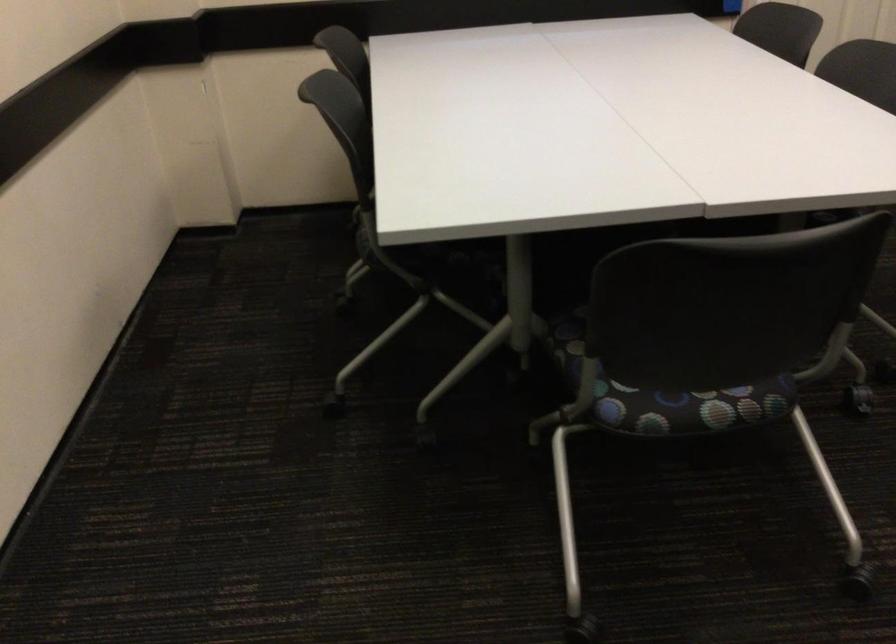
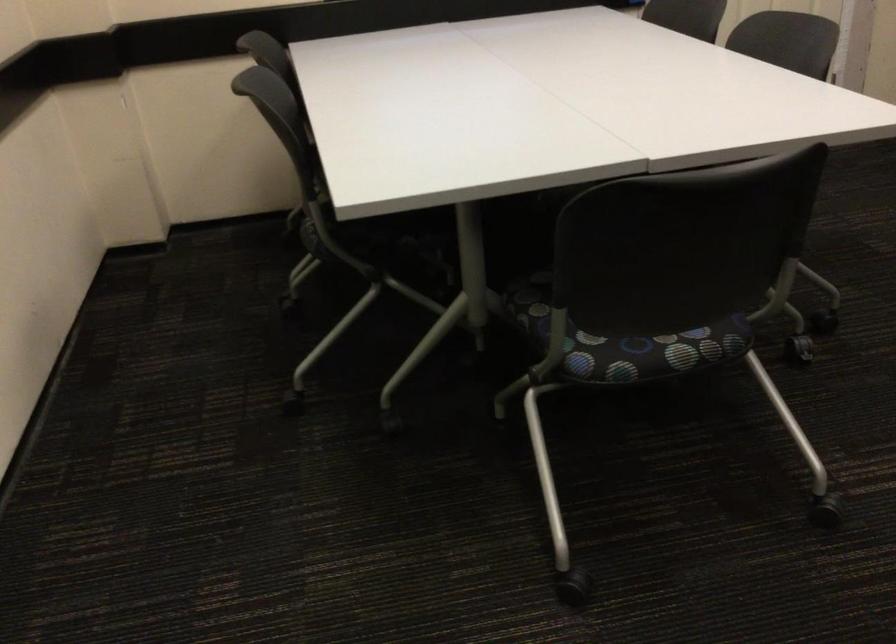
Question: The camera is either moving clockwise (left) or counter-clockwise (right) around the object. The first image is from the beginning of the video and the second image is from the end. Is the camera moving left or right when shooting the video?

Choices:
 (A) Left
 (B) Right

Answer: (A)